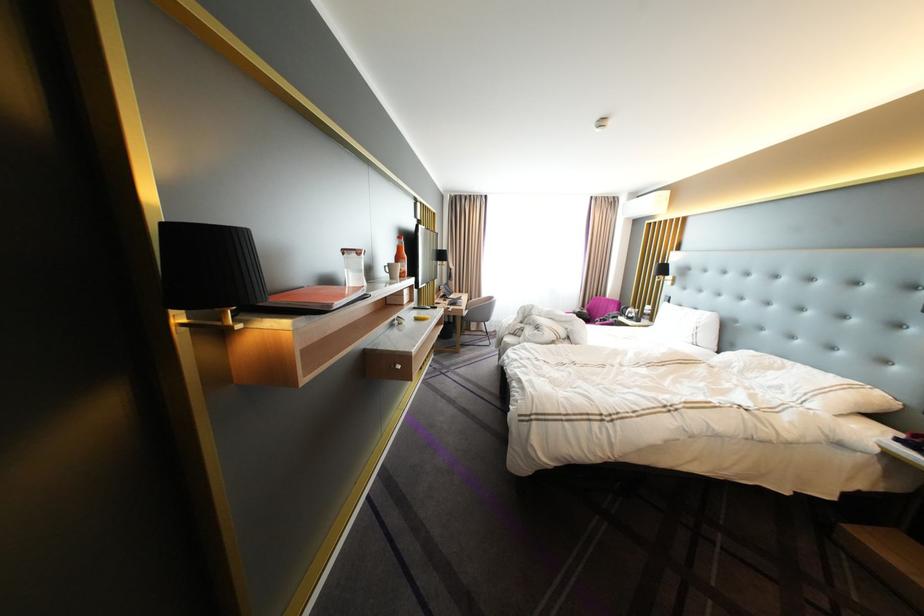
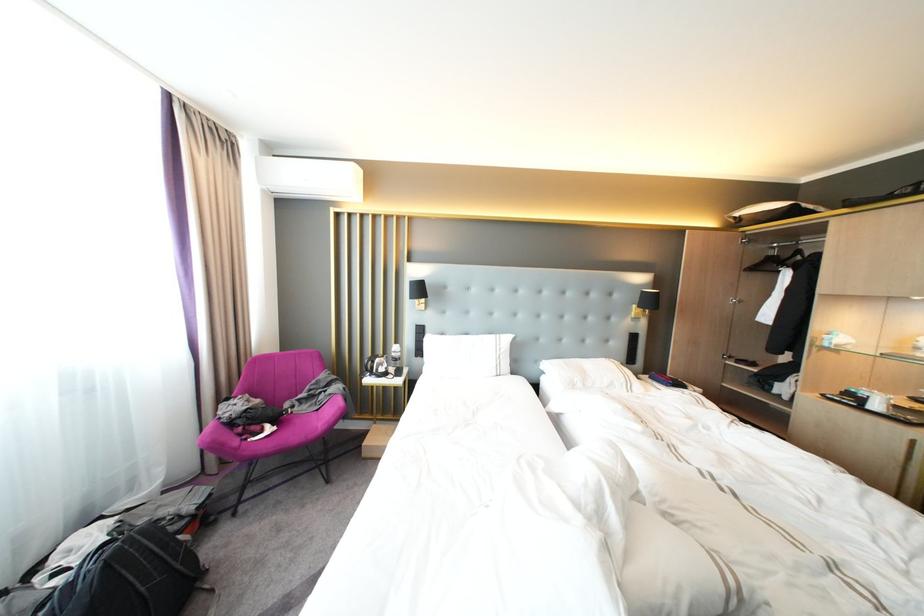
The point at (693, 307) is marked in the first image. Where is the corresponding point in the second image?

(455, 334)